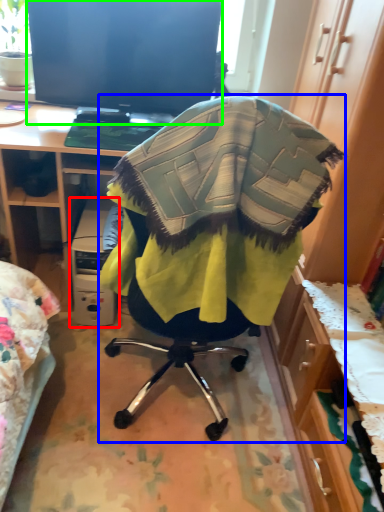
Question: Which object is positioned farthest from computer (highlighted by a red box)? Select from chair (highlighted by a blue box) and television (highlighted by a green box).

Choices:
 (A) chair
 (B) television

Answer: (A)